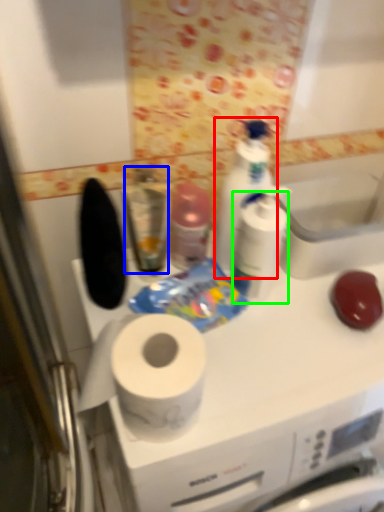
Question: Which object is the farthest from cleaning product (highlighted by a red box)? Choose among these: mouthwash (highlighted by a blue box) or toiletry (highlighted by a green box).

Choices:
 (A) mouthwash
 (B) toiletry

Answer: (A)